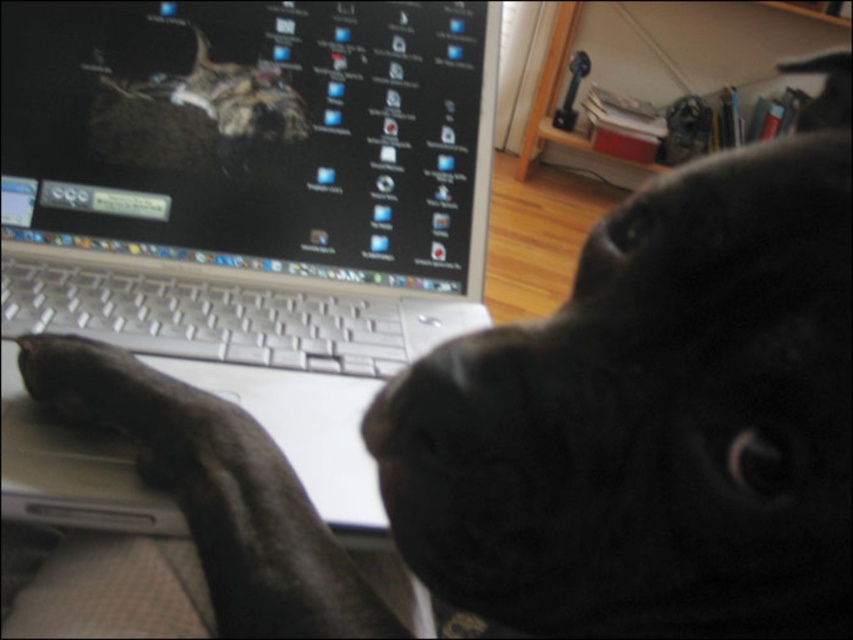
Can you confirm if silver metallic laptop at center is bigger than black matte nose at center?

Indeed, silver metallic laptop at center has a larger size compared to black matte nose at center.

Who is more forward, (x=19, y=227) or (x=436, y=436)?

Positioned in front is point (x=436, y=436).

Where is `silver metallic laptop at center`? Image resolution: width=853 pixels, height=640 pixels. silver metallic laptop at center is located at coordinates (238, 221).

Which is more to the left, silver metallic keyboard at center or black matte nose at center?

Positioned to the left is silver metallic keyboard at center.

Does point (374, 324) come in front of point (395, 401)?

No, (374, 324) is further to viewer.

The height and width of the screenshot is (640, 853). I want to click on silver metallic keyboard at center, so click(x=202, y=317).

Can you confirm if silver metallic laptop at center is positioned below silver metallic keyboard at center?

Incorrect, silver metallic laptop at center is not positioned below silver metallic keyboard at center.

Is point (19, 76) positioned before point (317, 296)?

Yes, point (19, 76) is closer to viewer.

Find the location of a particular element. silver metallic laptop at center is located at coordinates (238, 221).

At what (x,y) coordinates should I click in order to perform the action: click on silver metallic laptop at center. Please return your answer as a coordinate pair (x, y). Looking at the image, I should click on (238, 221).